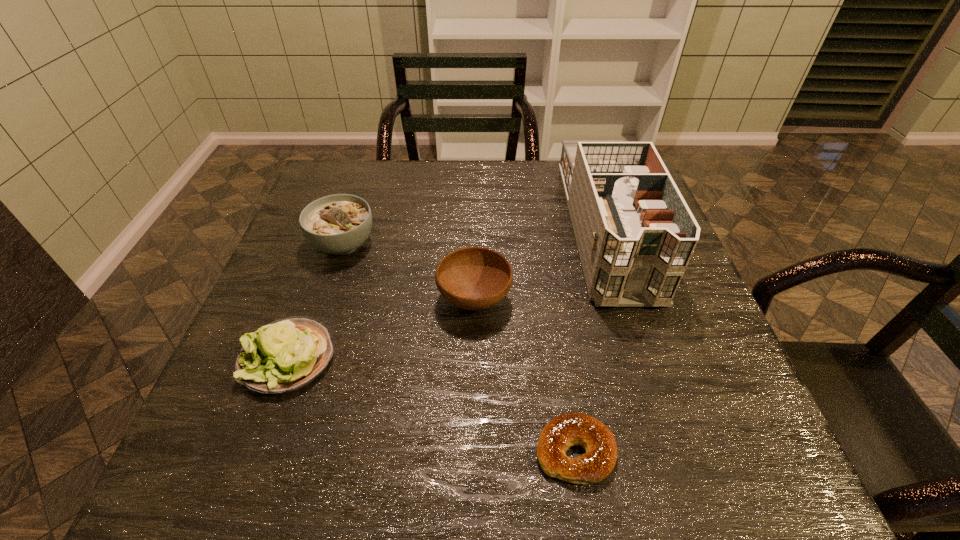
This screenshot has height=540, width=960. I want to click on vacant space located 0.070m on the front of the second shortest object, so [260, 436].

Where is `vacant space situated 0.190m on the right of the second object from right to left`? vacant space situated 0.190m on the right of the second object from right to left is located at coordinates (730, 450).

Locate an element on the screen. The width and height of the screenshot is (960, 540). object that is at the far edge is located at coordinates (635, 234).

Identify the location of object at the near edge. pyautogui.click(x=570, y=429).

The height and width of the screenshot is (540, 960). In order to click on soup bowl present at the left edge in this screenshot , I will do `click(338, 224)`.

The height and width of the screenshot is (540, 960). In order to click on lettuce that is at the left edge in this screenshot , I will do `click(285, 355)`.

Identify the location of object located in the right edge section of the desktop. (635, 234).

This screenshot has width=960, height=540. Identify the location of object situated at the far right corner. (635, 234).

Find the location of a particular element. Image resolution: width=960 pixels, height=540 pixels. vacant area at the far edge of the desktop is located at coordinates (423, 171).

Identify the location of vacant space at the near edge. This screenshot has width=960, height=540. pyautogui.click(x=640, y=474).